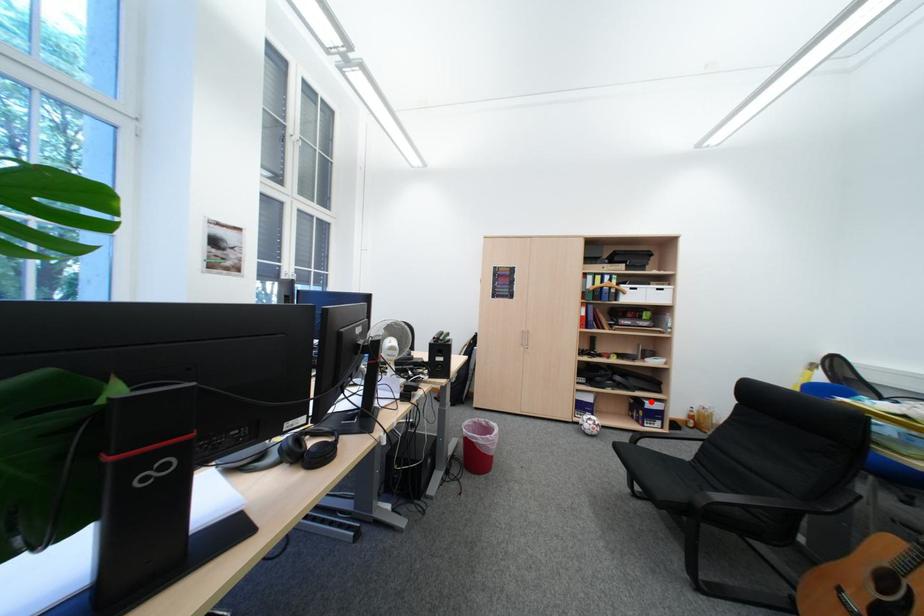
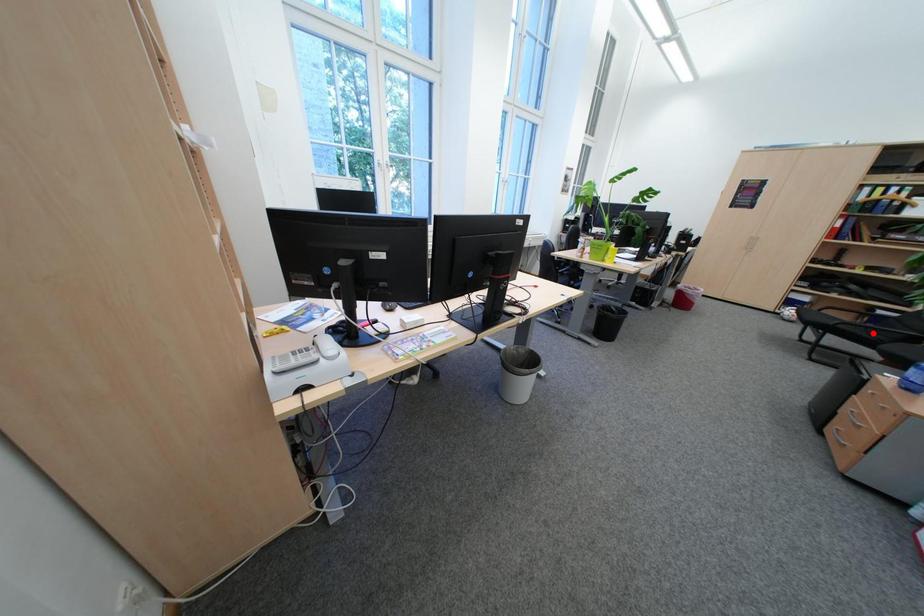
I am providing you with two images of the same scene from different viewpoints. A red point is marked on the first image and another point is marked on the second image. Do the highlighted points in image1 and image2 indicate the same real-world spot?

No